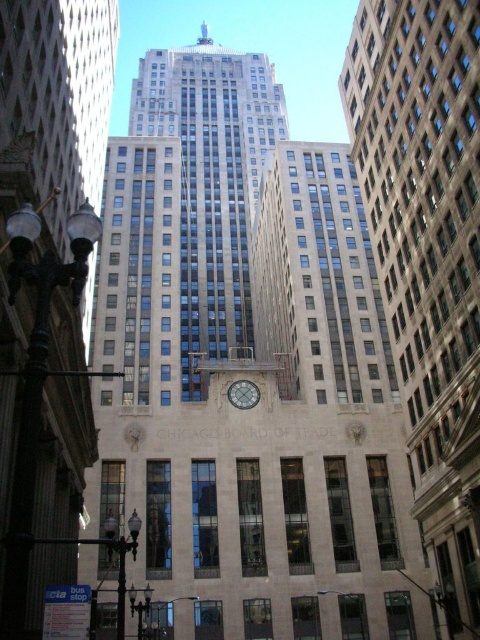
Does beige stone clock tower at center have a lesser height compared to stone clock tower at center?

No, beige stone clock tower at center is not shorter than stone clock tower at center.

Does point (112, 237) come farther from viewer compared to point (48, 38)?

Yes, it is behind point (48, 38).

Does point (123, 365) lie in front of point (0, 561)?

No, (123, 365) is behind (0, 561).

The image size is (480, 640). I want to click on beige stone clock tower at center, so click(x=248, y=369).

Who is higher up, stone clock tower at center or silver metallic clock at center?

stone clock tower at center is higher up.

Consider the image. Does stone clock tower at center appear on the left side of silver metallic clock at center?

Indeed, stone clock tower at center is positioned on the left side of silver metallic clock at center.

Where is `stone clock tower at center`? This screenshot has width=480, height=640. stone clock tower at center is located at coordinates (54, 108).

Locate an element on the screen. The image size is (480, 640). stone clock tower at center is located at coordinates (54, 108).

Can you confirm if beige stone clock tower at center is positioned above silver metallic clock at center?

Indeed, beige stone clock tower at center is positioned over silver metallic clock at center.

Who is more distant from viewer, (310, 490) or (243, 403)?

Positioned behind is point (243, 403).

Describe the element at coordinates (248, 369) in the screenshot. This screenshot has width=480, height=640. I see `beige stone clock tower at center` at that location.

The height and width of the screenshot is (640, 480). I want to click on beige stone clock tower at center, so click(248, 369).